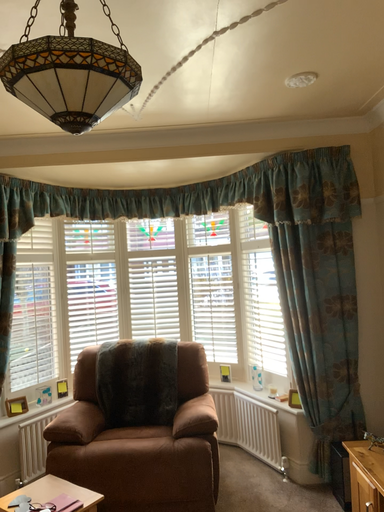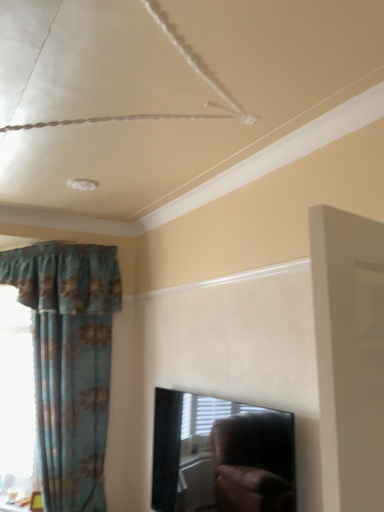
Question: Which way did the camera rotate in the video?

Choices:
 (A) rotated right
 (B) rotated left

Answer: (A)